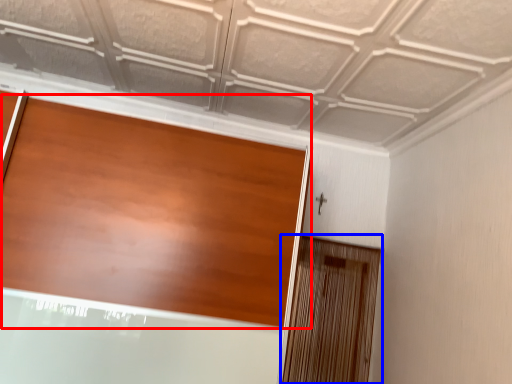
Question: Which object is further to the camera taking this photo, door (highlighted by a red box) or screen door (highlighted by a blue box)?

Choices:
 (A) door
 (B) screen door

Answer: (B)